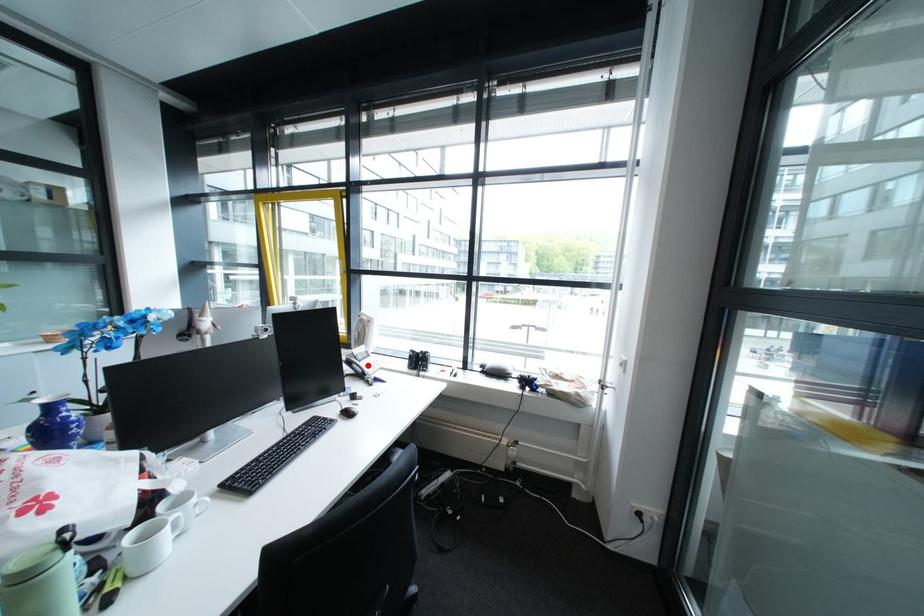
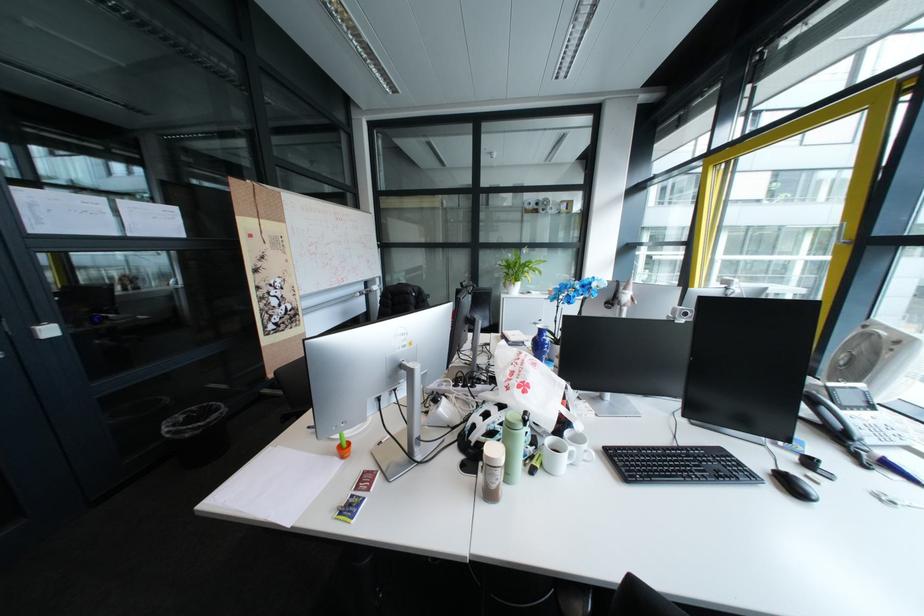
Locate, in the second image, the point that corresponds to the highlighted location in the first image.

(837, 408)